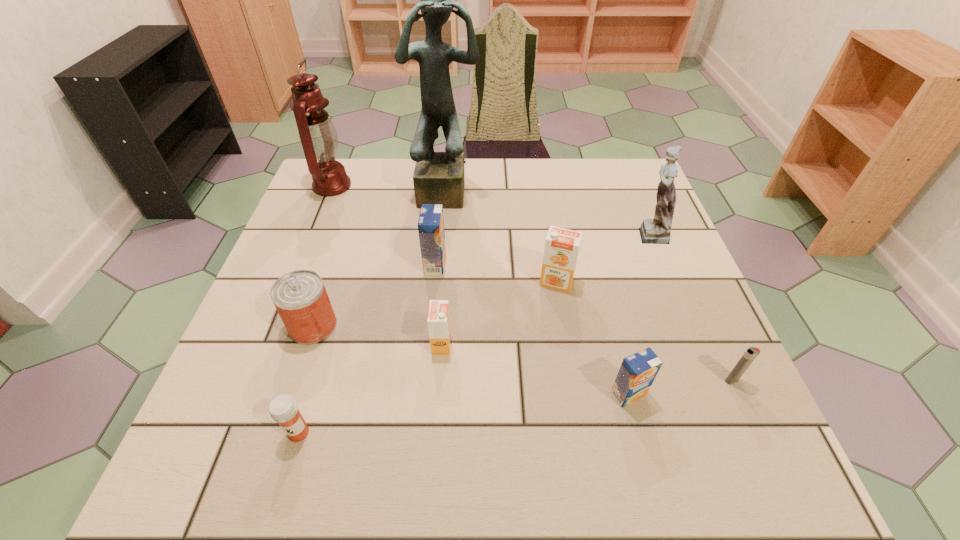
I want to click on vacant space that's between the can and the left blue orange_juice, so click(x=374, y=295).

Locate an element on the screen. The height and width of the screenshot is (540, 960). free area in between the can and the igniter is located at coordinates (522, 353).

The width and height of the screenshot is (960, 540). What are the coordinates of `free spot between the igniter and the second orange_juice from right to left` in the screenshot? It's located at (644, 331).

I want to click on vacant space that is in between the nearest orange_juice and the seventh object from left to right, so click(592, 338).

At what (x,y) coordinates should I click in order to perform the action: click on empty space between the nearer orange orange juice and the tallest object. Please return your answer as a coordinate pair (x, y). Image resolution: width=960 pixels, height=540 pixels. Looking at the image, I should click on (444, 267).

Find the location of a particular element. object that stands as the ninth closest to the nearest object is located at coordinates (658, 230).

At what (x,y) coordinates should I click in order to perform the action: click on object that is the fourth closest to the can. Please return your answer as a coordinate pair (x, y). The width and height of the screenshot is (960, 540). Looking at the image, I should click on (438, 178).

Find the location of a particular element. orange_juice that is the closest one to the igniter is located at coordinates (637, 372).

Locate which orange_juice ranks second in proximity to the medicine. Please provide its 2D coordinates. Your answer should be formatted as a tuple, i.e. [(x, y)], where the tuple contains the x and y coordinates of a point satisfying the conditions above.

[(431, 223)]

The image size is (960, 540). I want to click on free point that satisfies the following two spatial constraints: 1. on the front side of the can; 2. on the left side of the red oil lamp, so point(276,326).